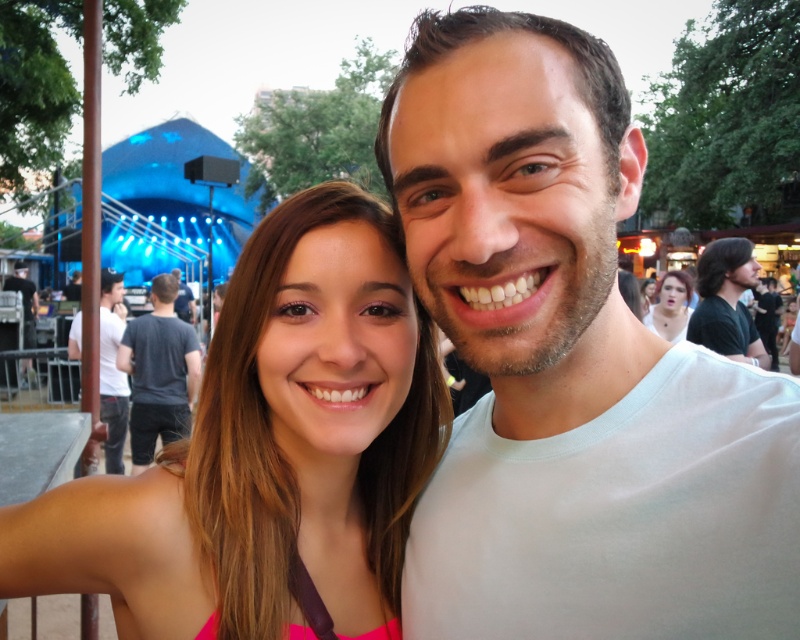
Is white matte shirt at center closer to the viewer compared to dark gray t-shirt at center?

That is True.

Does white matte shirt at center appear on the right side of dark gray t-shirt at center?

Correct, you'll find white matte shirt at center to the right of dark gray t-shirt at center.

Between point (772, 529) and point (190, 387), which one is positioned in front?

Point (772, 529)

Identify the location of white matte shirt at center. (570, 365).

Between white cotton t-shirt at left and matte black hair at upper center, which one has less height?

Standing shorter between the two is matte black hair at upper center.

Is white cotton t-shirt at left above matte black hair at upper center?

Actually, white cotton t-shirt at left is below matte black hair at upper center.

Between point (73, 333) and point (682, 326), which one is positioned in front?

Point (682, 326) is in front.

I want to click on white cotton t-shirt at left, so click(x=112, y=369).

Between dark gray t-shirt at center and dark gray shirt at left, which one has less height?

dark gray t-shirt at center

Is dark gray t-shirt at center to the left of dark gray shirt at left from the viewer's perspective?

In fact, dark gray t-shirt at center is to the right of dark gray shirt at left.

Is point (160, 376) in front of point (26, 339)?

Yes, point (160, 376) is closer to viewer.

In order to click on dark gray t-shirt at center in this screenshot , I will do `click(160, 372)`.